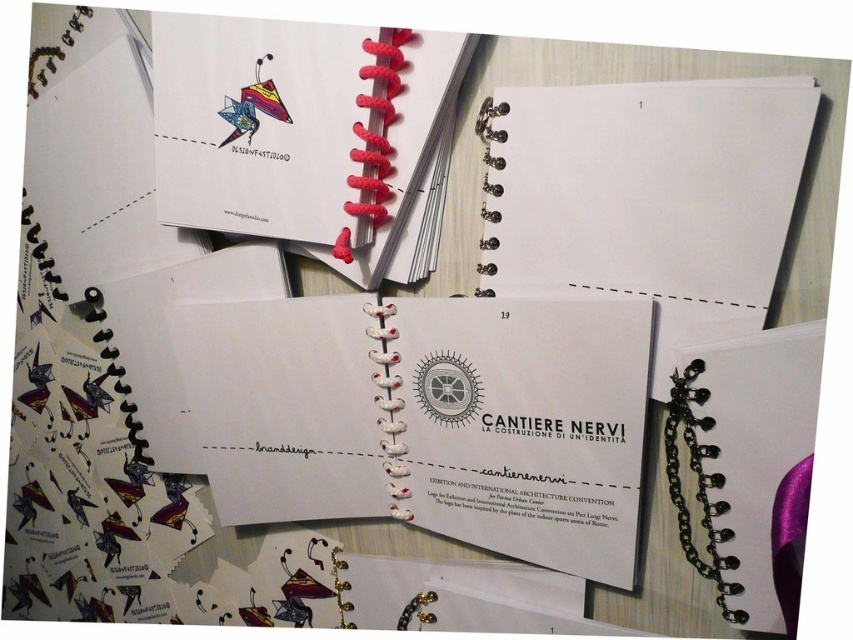
Is white paper notebook at center thinner than white paper at center?

No.

Between white paper notebook at center and white paper at center, which one has less height?

With less height is white paper at center.

Does point (508, 554) come behind point (718, 157)?

Yes, point (508, 554) is farther from viewer.

Locate an element on the screen. Image resolution: width=853 pixels, height=640 pixels. white paper notebook at center is located at coordinates (428, 419).

Can you confirm if white paper notebook at center is positioned to the right of black chain-link notebook at center?

In fact, white paper notebook at center is to the left of black chain-link notebook at center.

Between white paper notebook at center and black chain-link notebook at center, which one has less height?

With less height is black chain-link notebook at center.

Who is more distant from viewer, (219, 436) or (767, 566)?

The point (219, 436) is more distant.

What are the coordinates of `white paper notebook at center` in the screenshot? It's located at (428, 419).

Is white paper at center smaller than matte red spiral notebook at upper center?

Correct, white paper at center occupies less space than matte red spiral notebook at upper center.

Who is shorter, white paper at center or matte red spiral notebook at upper center?

white paper at center

What do you see at coordinates (646, 196) in the screenshot?
I see `white paper at center` at bounding box center [646, 196].

In order to click on white paper at center in this screenshot , I will do `click(646, 196)`.